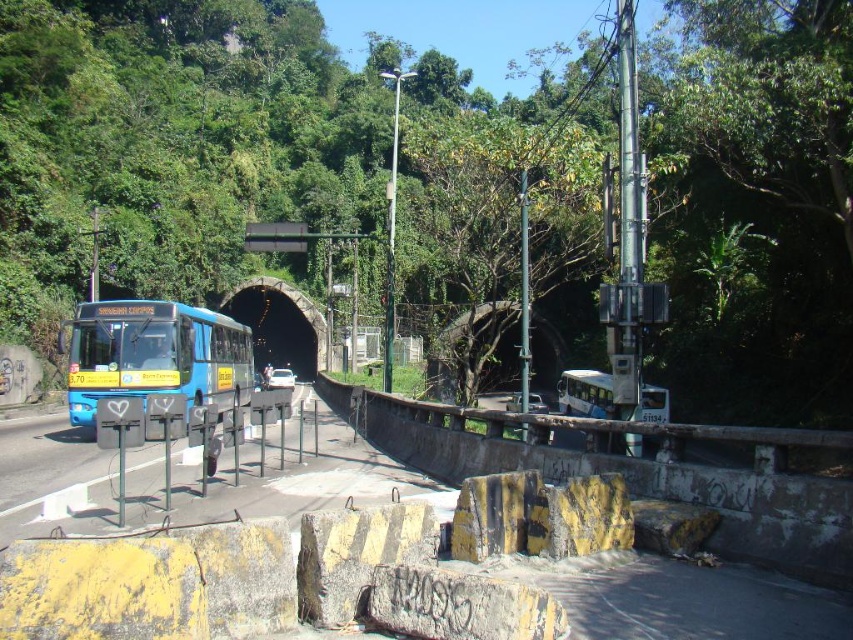
Question: Considering the relative positions of yellow painted concrete barrier at lower center and black concrete tunnel at center in the image provided, where is yellow painted concrete barrier at lower center located with respect to black concrete tunnel at center?

Choices:
 (A) above
 (B) below

Answer: (B)

Question: Estimate the real-world distances between objects in this image. Which object is closer to the blue matte bus at left?

Choices:
 (A) black concrete tunnel at center
 (B) yellow painted concrete barrier at lower center

Answer: (B)

Question: Where is yellow painted concrete barrier at lower center located in relation to blue matte bus at left in the image?

Choices:
 (A) right
 (B) left

Answer: (A)

Question: Which point appears farthest from the camera in this image?

Choices:
 (A) (294, 353)
 (B) (511, 449)

Answer: (A)

Question: Which point is closer to the camera taking this photo?

Choices:
 (A) (287, 356)
 (B) (117, 388)
 (C) (786, 481)

Answer: (C)

Question: Does yellow painted concrete barrier at lower center appear over blue matte bus at left?

Choices:
 (A) yes
 (B) no

Answer: (B)